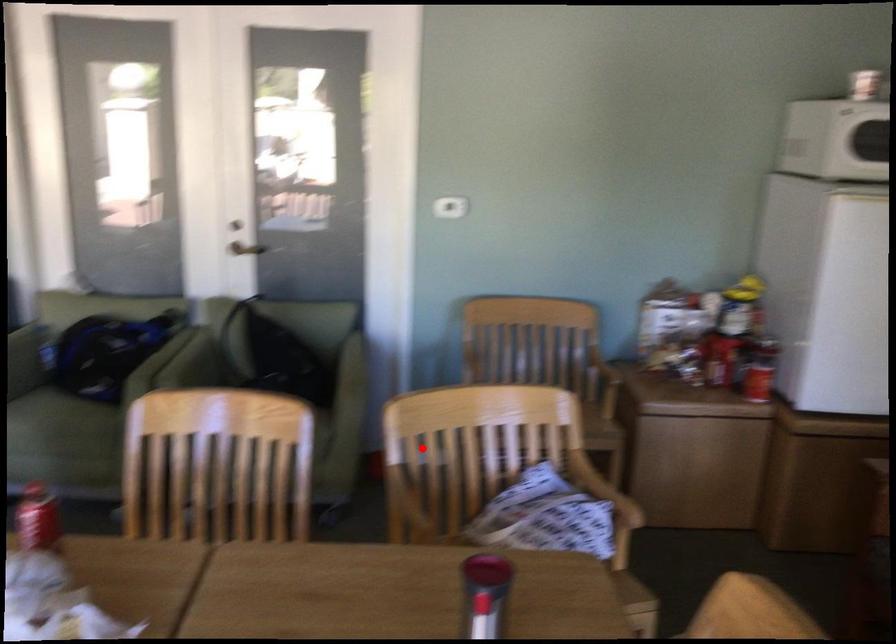
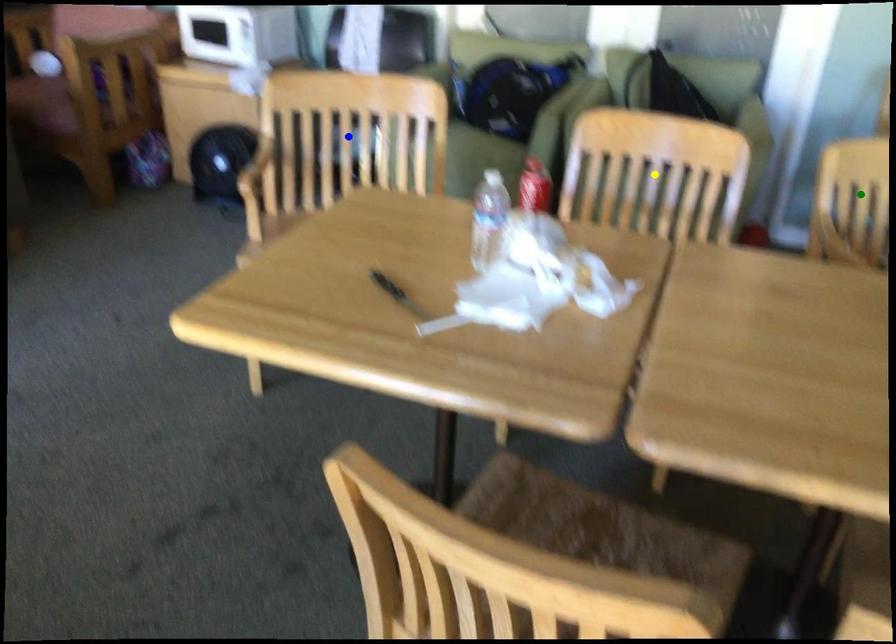
Question: I am providing you with two images of the same scene from different viewpoints. A red point is marked on the first image. You are given multiple points on the second image. In image 2, which mark is for the same physical point as the one in image 1?

Choices:
 (A) yellow point
 (B) green point
 (C) blue point

Answer: (B)